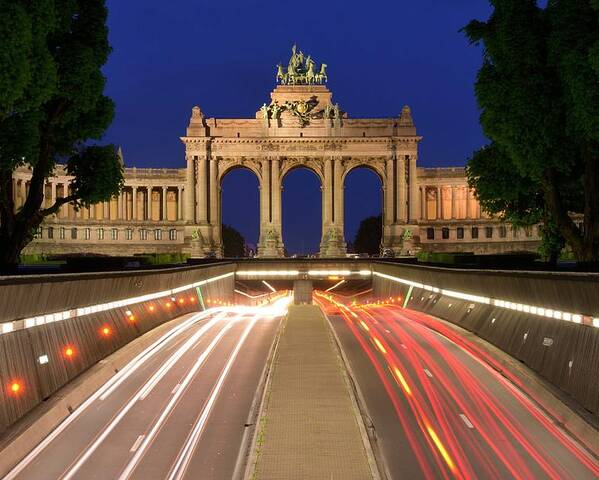
Locate an element on the screen. This screenshot has width=599, height=480. archway is located at coordinates (353, 160), (288, 159), (244, 168).